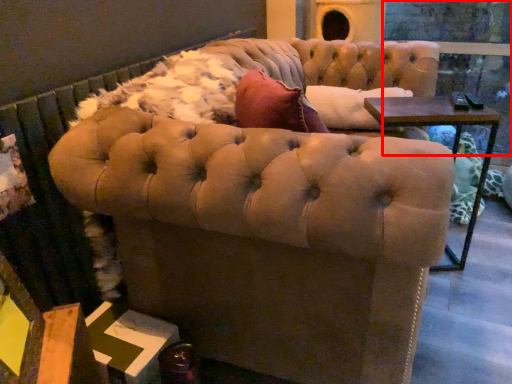
Question: From the image's perspective, considering the relative positions of glass door (annotated by the red box) and chair in the image provided, where is glass door (annotated by the red box) located with respect to the staircase?

Choices:
 (A) above
 (B) below

Answer: (A)